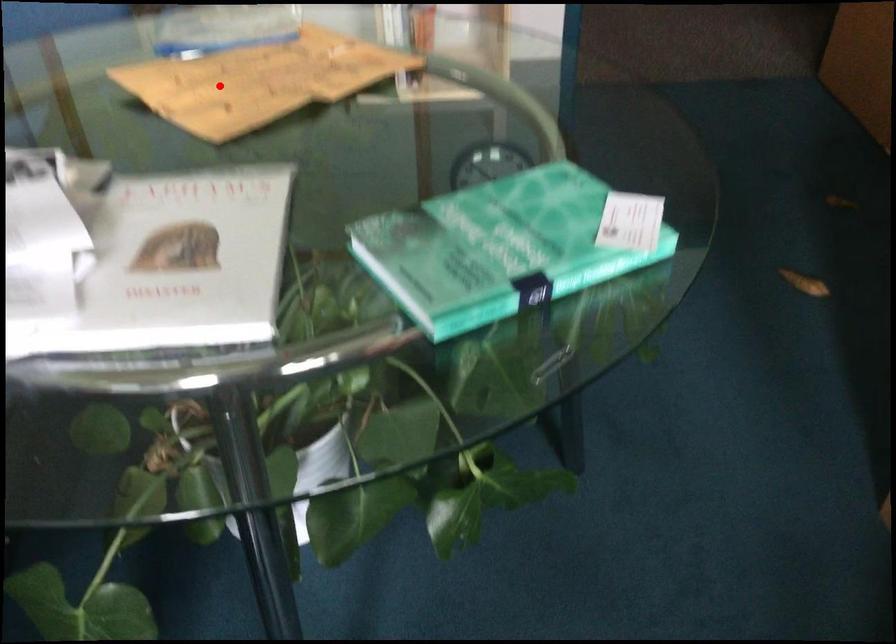
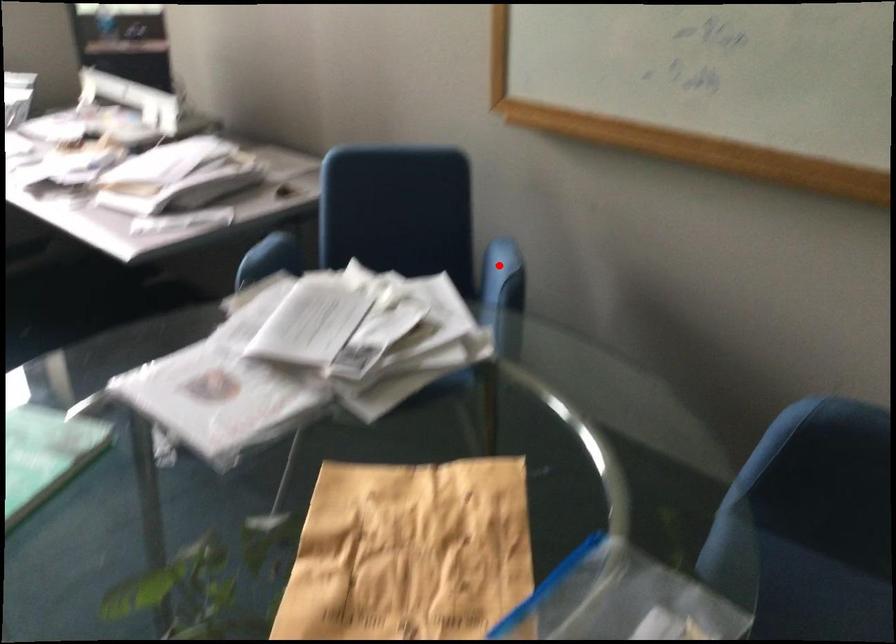
I am providing you with two images of the same scene from different viewpoints. A red point is marked on the first image and another point is marked on the second image. Does the point marked in image1 correspond to the same location as the one in image2?

No